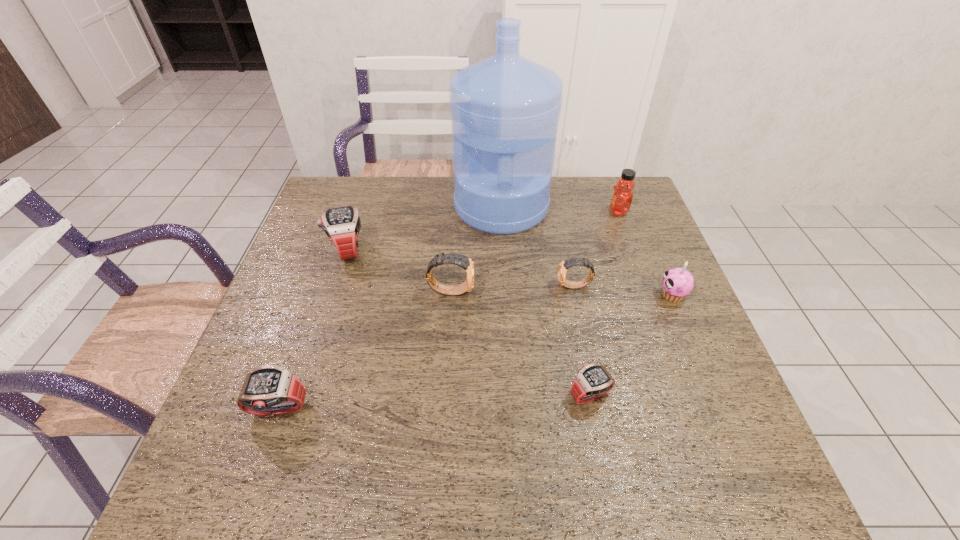
Where is `blue water jug`? The width and height of the screenshot is (960, 540). blue water jug is located at coordinates (505, 109).

Find the location of a particular element. This screenshot has height=540, width=960. water jug is located at coordinates (505, 109).

I want to click on honey, so click(x=622, y=197).

Locate an element on the screen. The height and width of the screenshot is (540, 960). the biggest red watch is located at coordinates (342, 225).

Where is `the farthest red watch`? the farthest red watch is located at coordinates (342, 225).

Locate an element on the screen. the third watch from right to left is located at coordinates (463, 261).

This screenshot has height=540, width=960. What are the coordinates of `the left gold watch` in the screenshot? It's located at (463, 261).

Identify the location of cupcake. The height and width of the screenshot is (540, 960). (677, 283).

At what (x,y) coordinates should I click in order to perform the action: click on the second biggest red watch. Please return your answer as a coordinate pair (x, y). This screenshot has height=540, width=960. Looking at the image, I should click on (270, 390).

At what (x,y) coordinates should I click in order to perform the action: click on the smaller gold watch. Please return your answer as a coordinate pair (x, y). This screenshot has height=540, width=960. Looking at the image, I should click on (564, 265).